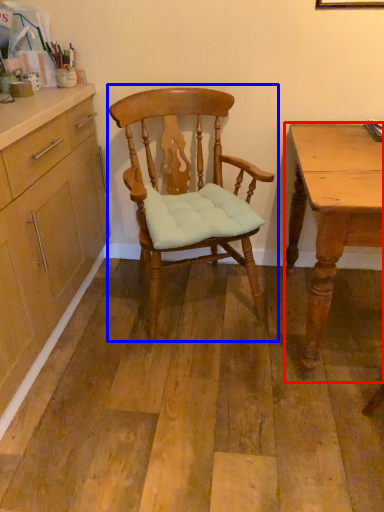
Question: Which point is closer to the camera, desk (highlighted by a red box) or chair (highlighted by a blue box)?

Choices:
 (A) desk
 (B) chair

Answer: (A)